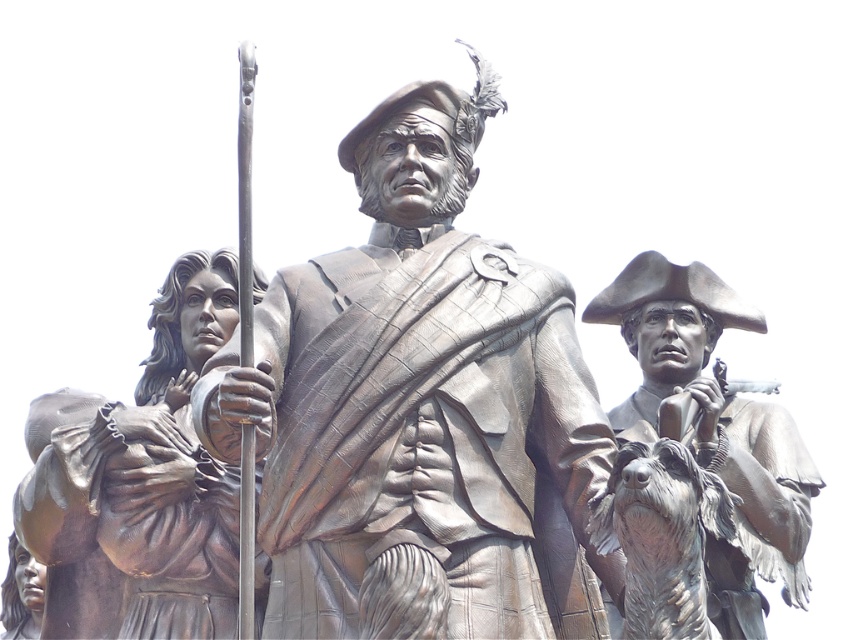
You are an art curator planning to display the bronze statue at left and bronze statue at right in a gallery. Given their sizes, which statue should be placed on the main pedestal to emphasize its prominence?

The bronze statue at left should be placed on the main pedestal because it is larger in size than the bronze statue at right, making it more prominent.

You are standing in front of the bronze statue at left. Where would you place a small plaque indicating its location relative to the central figure?

The bronze statue at left is located at point (138, 484), which means it is positioned to the left and slightly below the central figure in the image.

You are an art conservator assessing the spacing between two bronze statues in a gallery. The statues are the bronze statue at center and the bronze statue at left. Given that the gallery has a narrow corridor only 1.2 meters wide, can both statues be displayed side by side without overlapping?

The bronze statue at center might be wider than bronze statue at left. Since the width of the bronze statue at center is uncertain, it is possible that placing both statues side by side in a 1.2 meter wide corridor could result in overlap. To ensure proper display, measurements of both statues should be taken to confirm their combined width fits within the space.